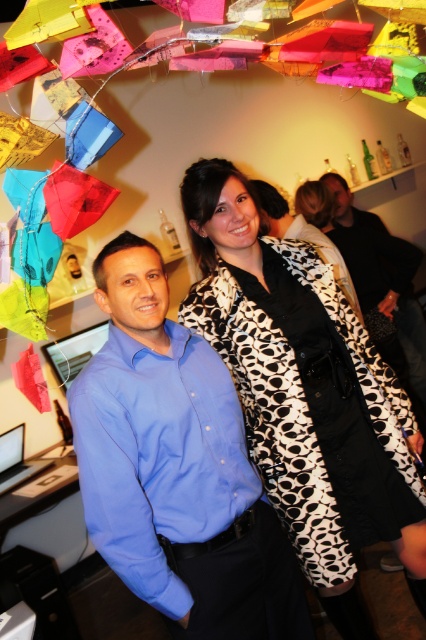
You are a photographer trying to capture a candid shot of the two people in the scene. The black and white dotted coat at center is between you and the person wearing the light blue button shirt. Can you adjust your position so that the coat is no longer blocking your view of the light blue shirt?

The two people are 4.55 feet apart, so yes, you can move to the side to avoid the black and white dotted coat at center and get a clear shot of the person in the light blue button shirt.

You are a photographer setting up a camera to capture a group photo. You notice the black and white dotted coat at center and the blue shirt at center. Which of these two items is wider?

The black and white dotted coat at center is wider than the blue shirt at center because its width surpasses that of the blue shirt at center.

From the picture: You are at a party and want to take a photo with the black and white dotted coat at center and the dark brown leather jacket at upper right. Which one will be more visible in the photo?

The black and white dotted coat at center will be more visible in the photo because it is in front of the dark brown leather jacket at upper right.